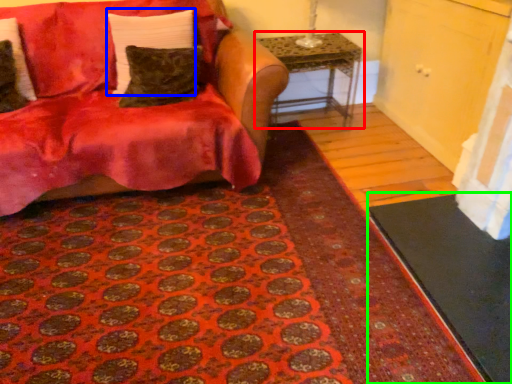
Question: Estimate the real-world distances between objects in this image. Which object is farther from table (highlighted by a red box), pillow (highlighted by a blue box) or doormat (highlighted by a green box)?

Choices:
 (A) pillow
 (B) doormat

Answer: (B)